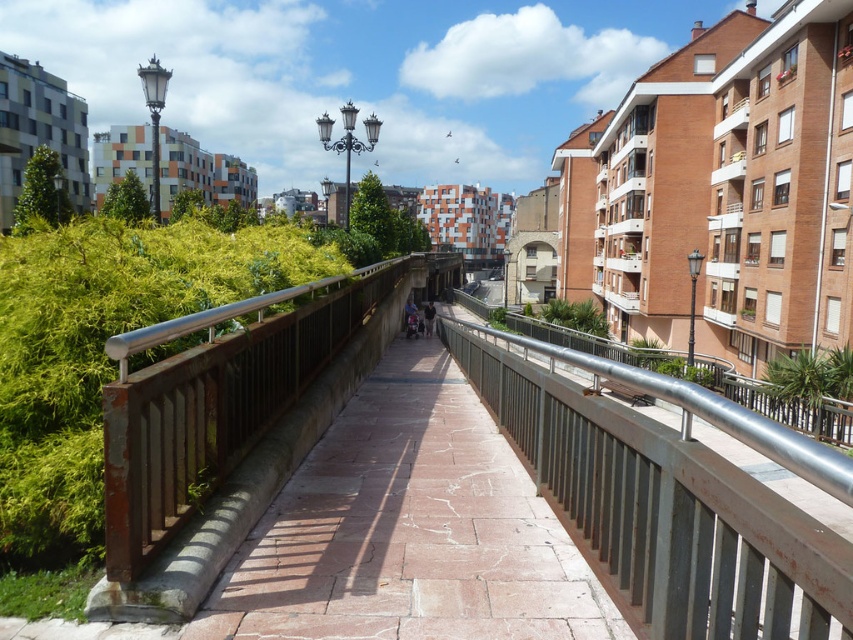
You are a delivery person with a cart that is 3 meters wide. You need to move along the walkway between the metallic silver railing at center and the rusty wood balustrade at center. Can your cart fit through the space between them?

The space between the metallic silver railing at center and the rusty wood balustrade at center is 2.80 meters. Since your cart is 3 meters wide, it cannot fit through the space between them.

You are standing on the walkway and want to take a photo of both the point at coordinates (x=456, y=323) and the point at (x=225, y=342). Which point should you focus on first to ensure both are in focus?

You should focus on the point at (x=225, y=342) first because it is closer to you than the point at (x=456, y=323), which is further away. This way, the camera can adjust the focus to capture both points clearly.

You are a delivery person carrying a large package that is 1.2 meters wide. You need to navigate through the walkway between the metallic silver railing at center and the rusty wood balustrade at center. Can your package fit through the space between them?

The metallic silver railing at center has a larger size compared to the rusty wood balustrade at center. Since the package is 1.2 meters wide and the space between the railings is determined by their sizes, the package should fit as long as the distance between them is at least 1.2 meters. However, the description only mentions the size comparison between the railings, not the exact spacing. Without knowing the exact distance between them, it is uncertain if the package will fit.